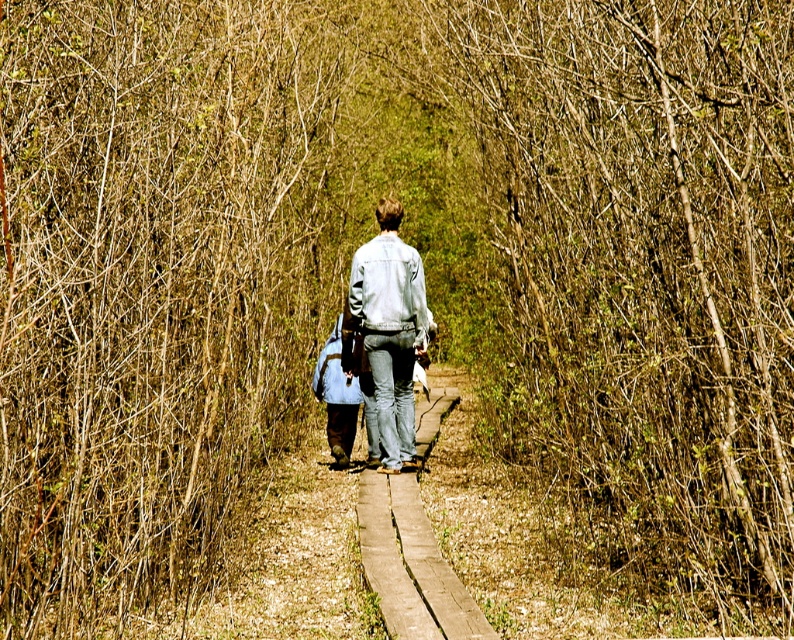
Question: Which point appears farthest from the camera in this image?

Choices:
 (A) (369, 301)
 (B) (218, 417)

Answer: (A)

Question: Which object appears farthest from the camera in this image?

Choices:
 (A) brown leafless trees at center
 (B) denim jacket at center

Answer: (B)

Question: Does brown leafless trees at center have a lesser width compared to denim jacket at center?

Choices:
 (A) no
 (B) yes

Answer: (A)

Question: Is brown leafless trees at center wider than denim jacket at center?

Choices:
 (A) yes
 (B) no

Answer: (A)

Question: Can you confirm if brown leafless trees at center is thinner than denim jacket at center?

Choices:
 (A) no
 (B) yes

Answer: (A)